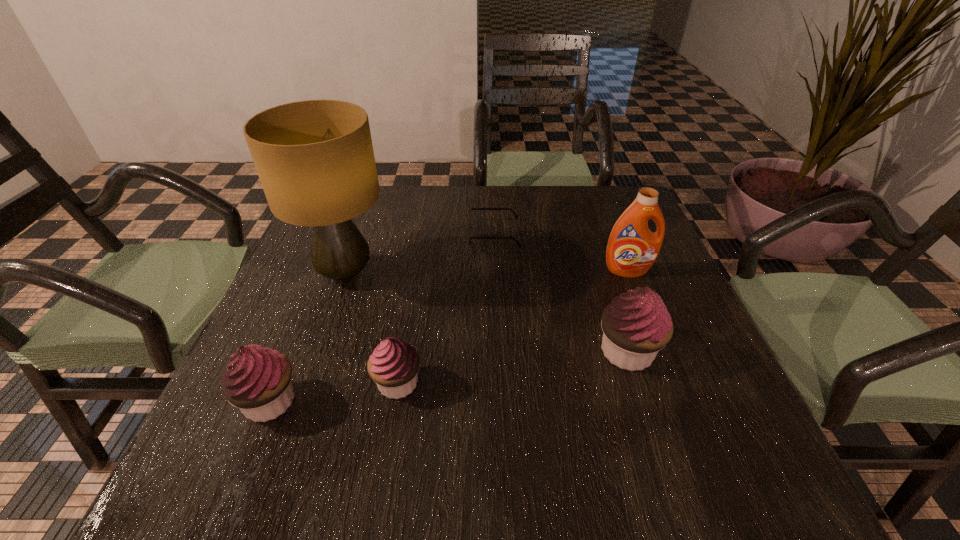
What are the coordinates of `vacant point located 0.050m on the front of the shortest cupcake` in the screenshot? It's located at (390, 430).

This screenshot has width=960, height=540. I want to click on vacant area located 0.400m on the left of the rightmost cupcake, so click(x=394, y=352).

Identify the location of free region located at the hinge ends of the spectacles. The height and width of the screenshot is (540, 960). (353, 235).

Locate an element on the screen. The width and height of the screenshot is (960, 540). free spot located at the hinge ends of the spectacles is located at coordinates (331, 235).

The height and width of the screenshot is (540, 960). I want to click on vacant region located 0.190m at the hinge ends of the spectacles, so click(x=396, y=235).

The height and width of the screenshot is (540, 960). I want to click on free space located 0.140m on the back of the lampshade, so click(x=366, y=215).

The height and width of the screenshot is (540, 960). I want to click on free space located 0.200m on the front-facing side of the detergent, so click(656, 343).

Where is `object that is at the far edge`? object that is at the far edge is located at coordinates (469, 221).

The width and height of the screenshot is (960, 540). I want to click on cupcake located in the left edge section of the desktop, so click(257, 380).

The height and width of the screenshot is (540, 960). Identify the location of lampshade present at the left edge. (315, 160).